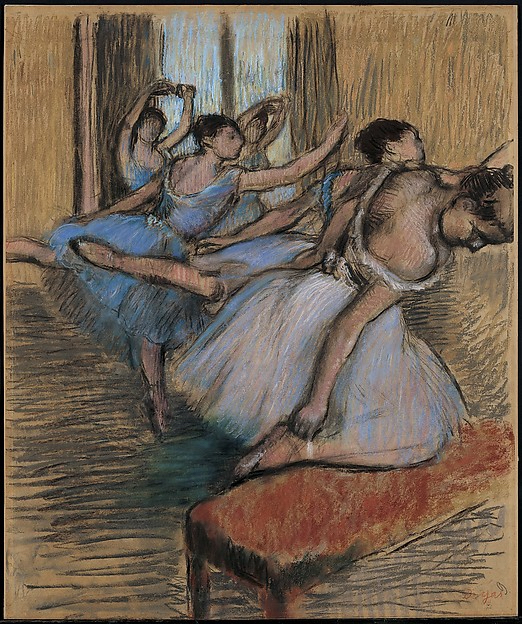
Find the location of `bench`. bench is located at coordinates pos(296,515), pos(472,452).